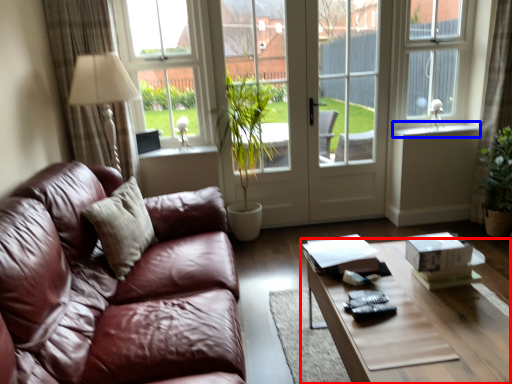
Question: Which object is further to the camera taking this photo, coffee table (highlighted by a red box) or window sill (highlighted by a blue box)?

Choices:
 (A) coffee table
 (B) window sill

Answer: (B)